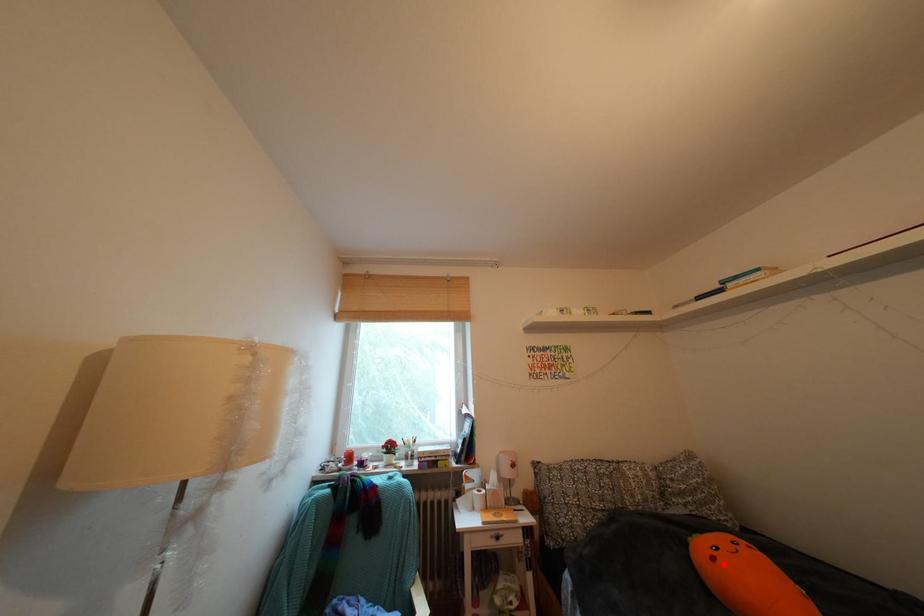
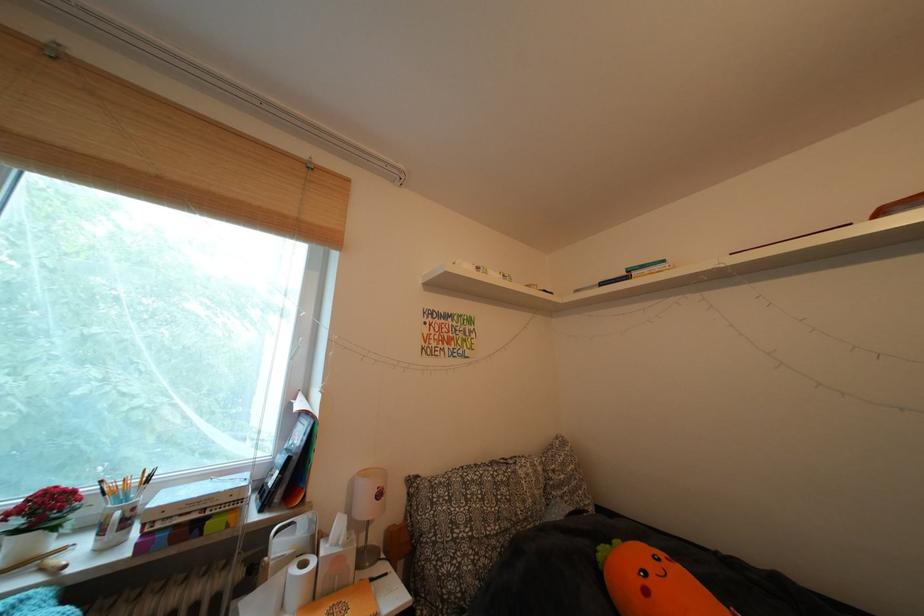
Where in the second image is the point corresponding to the highlighted location from the first image?

(657, 597)